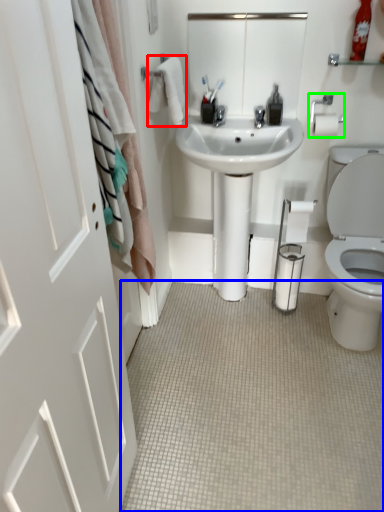
Question: Based on their relative distances, which object is farther from bath towel (highlighted by a red box)? Choose from plain (highlighted by a blue box) and towel bar (highlighted by a green box).

Choices:
 (A) plain
 (B) towel bar

Answer: (A)